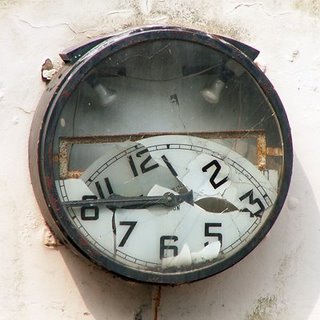
You are a GUI agent. You are given a task and a screenshot of the screen. Output one action in this format:
    pyautogui.click(x=<x>, y=<y>)
    Task: Click on the clock body
    
    Given the screenshot: What is the action you would take?
    pyautogui.click(x=36, y=154), pyautogui.click(x=286, y=166)